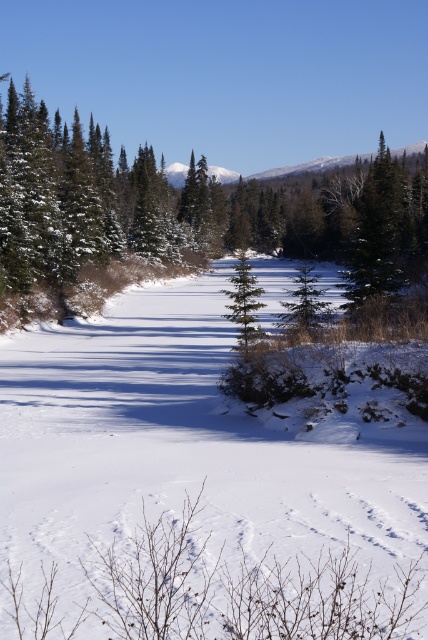
You are standing at the camera position looking at the winter landscape. The white fluffy snow at center is your main focus. If you want to take a closer look at the snow without moving, which direction should you tilt your head or camera?

Since the white fluffy snow at center is 8.68 meters away from the camera, you would need to tilt your head or camera forward towards the snow to get a closer look without moving your position.

You are an observer standing in the winter landscape. You notice the white fluffy snow at center and the green matte evergreen tree at center. Which object is taller?

The green matte evergreen tree at center is taller than the white fluffy snow at center.